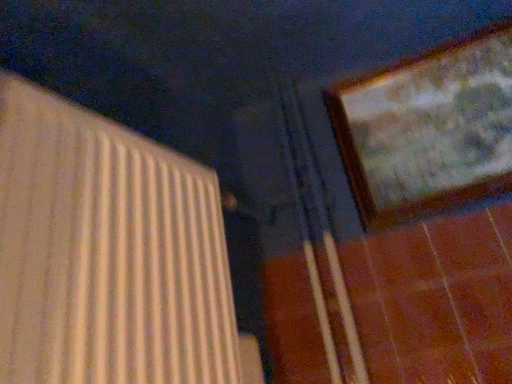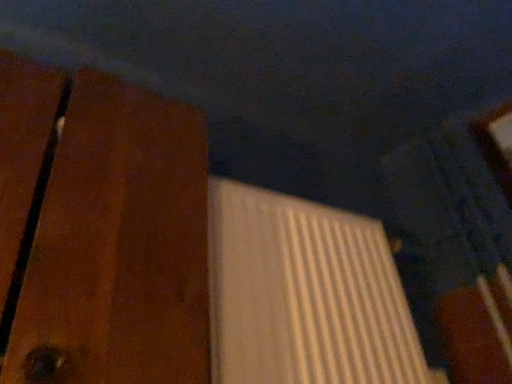
Question: How did the camera likely rotate when shooting the video?

Choices:
 (A) rotated left
 (B) rotated right

Answer: (A)